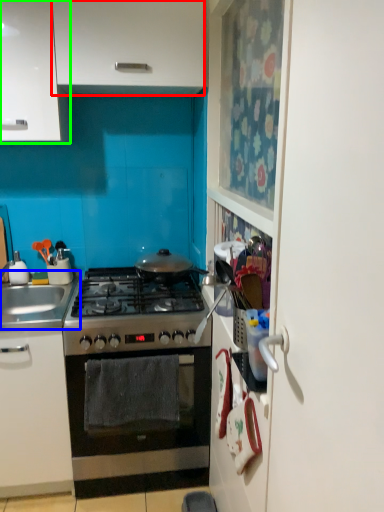
Question: Based on their relative distances, which object is farther from cabinetry (highlighted by a red box)? Choose from sink (highlighted by a blue box) and cabinetry (highlighted by a green box).

Choices:
 (A) sink
 (B) cabinetry

Answer: (A)